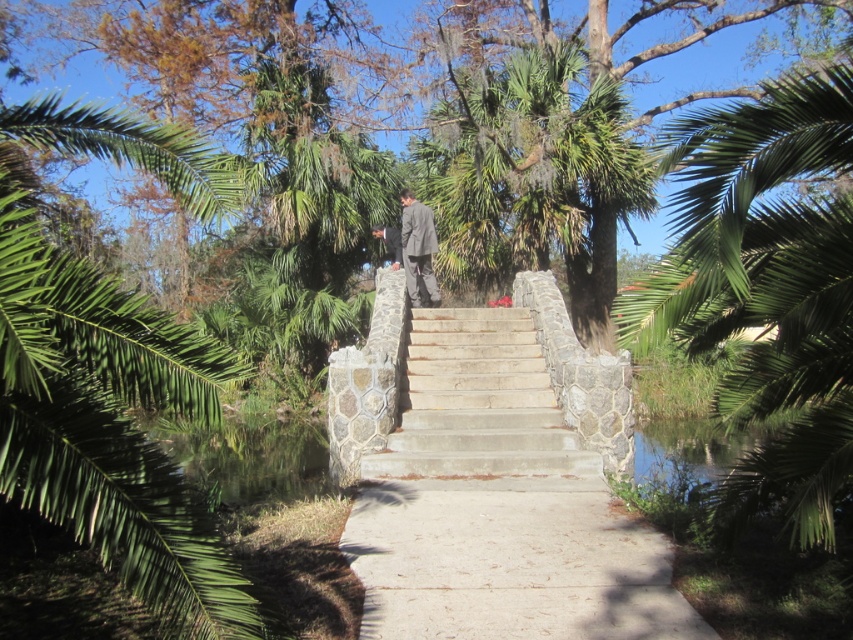
Question: From the image, what is the correct spatial relationship of concrete/stone path at center in relation to concrete at center?

Choices:
 (A) right
 (B) left

Answer: (B)

Question: Is green leafy palm tree at left above concrete at center?

Choices:
 (A) no
 (B) yes

Answer: (B)

Question: Which of the following is the closest to the observer?

Choices:
 (A) (726, 298)
 (B) (125, 579)

Answer: (B)

Question: Among these objects, which one is nearest to the camera?

Choices:
 (A) dark gray suit at center
 (B) green leafy palm tree at left
 (C) green leafy palm tree at right

Answer: (B)

Question: Based on their relative distances, which object is nearer to the concrete/stone stairs at center?

Choices:
 (A) concrete at center
 (B) concrete/stone path at center

Answer: (A)

Question: Observing the image, what is the correct spatial positioning of concrete/stone path at center in reference to dark gray suit at center?

Choices:
 (A) above
 (B) below

Answer: (B)